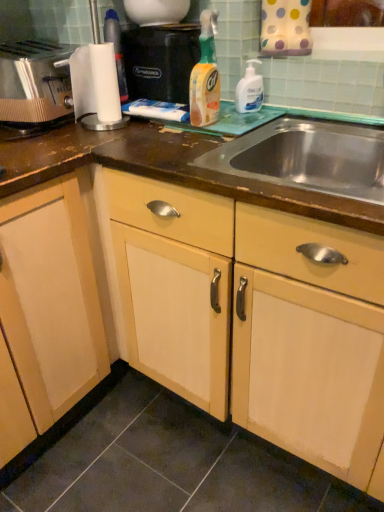
Find the location of a particular element. This screenshot has width=384, height=512. free space in front of white glossy pump bottle at upper right, acting as the 1th cleaning product starting from the right is located at coordinates (243, 120).